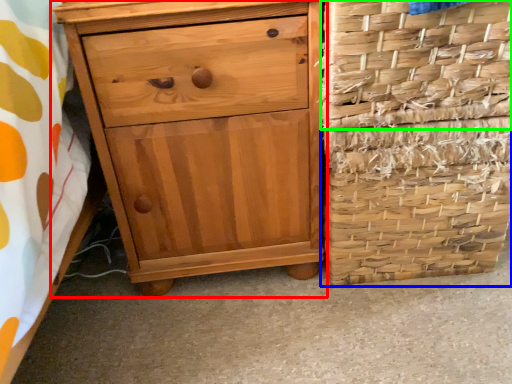
Question: Which object is positioned farthest from chest of drawers (highlighted by a red box)? Select from basket container (highlighted by a blue box) and basket (highlighted by a green box).

Choices:
 (A) basket container
 (B) basket

Answer: (B)